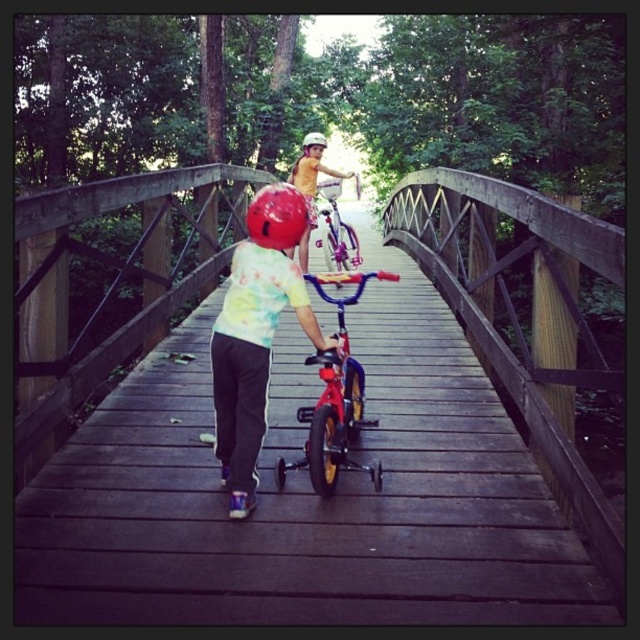
Question: Considering the relative positions of metallic purple bicycle at center and white matte helmet at upper center in the image provided, where is metallic purple bicycle at center located with respect to white matte helmet at upper center?

Choices:
 (A) right
 (B) left

Answer: (A)

Question: Among these points, which one is farthest from the camera?

Choices:
 (A) (337, 420)
 (B) (307, 148)

Answer: (B)

Question: Which is nearer to the wooden bridge at center?

Choices:
 (A) white matte helmet at upper center
 (B) metallic blue bicycle at center

Answer: (B)

Question: Where is matte red helmet at center located in relation to matte yellow shirt at center in the image?

Choices:
 (A) above
 (B) below

Answer: (B)

Question: Does wooden bridge at center come in front of metallic blue bicycle at center?

Choices:
 (A) yes
 (B) no

Answer: (B)

Question: Which point is closer to the camera taking this photo?

Choices:
 (A) (339, 275)
 (B) (348, 232)
 (C) (262, 188)
 (D) (384, 392)

Answer: (A)